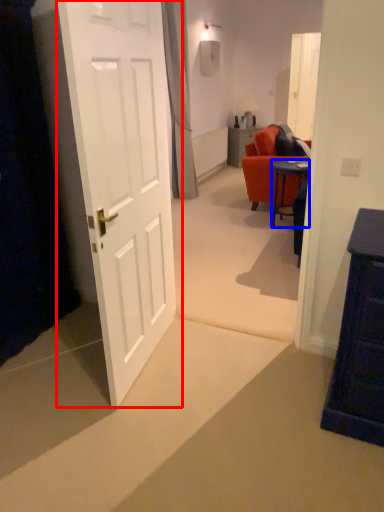
Question: Which point is further to the camera, door (highlighted by a red box) or desk (highlighted by a blue box)?

Choices:
 (A) door
 (B) desk

Answer: (B)